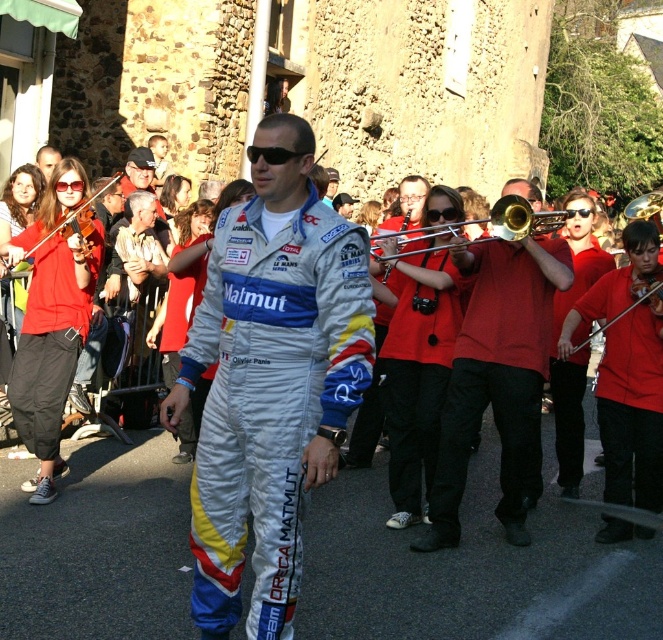
Does red fabric trombone at center have a greater height compared to gold brass trombone at center?

No.

Who is more distant from viewer, (463, 332) or (575, 320)?

Positioned behind is point (575, 320).

Which is in front, point (463, 419) or point (564, 352)?

Positioned in front is point (463, 419).

What are the coordinates of `red fabric trombone at center` in the screenshot? It's located at (497, 378).

From the picture: Does gold brass trumpet at center have a greater width compared to gold brass trombone at center?

In fact, gold brass trumpet at center might be narrower than gold brass trombone at center.

Is point (536, 221) positioned before point (566, 340)?

Yes, it is.

Does point (546, 228) come in front of point (595, 332)?

No, it is behind (595, 332).

Locate an element on the screen. gold brass trumpet at center is located at coordinates (520, 218).

Is point (235, 444) farther from viewer compared to point (546, 248)?

No, it is not.

Is white fabric racing suit at center closer to camera compared to red fabric trombone at center?

Yes.

This screenshot has width=663, height=640. What do you see at coordinates (271, 380) in the screenshot? I see `white fabric racing suit at center` at bounding box center [271, 380].

Locate an element on the screen. The width and height of the screenshot is (663, 640). white fabric racing suit at center is located at coordinates (271, 380).